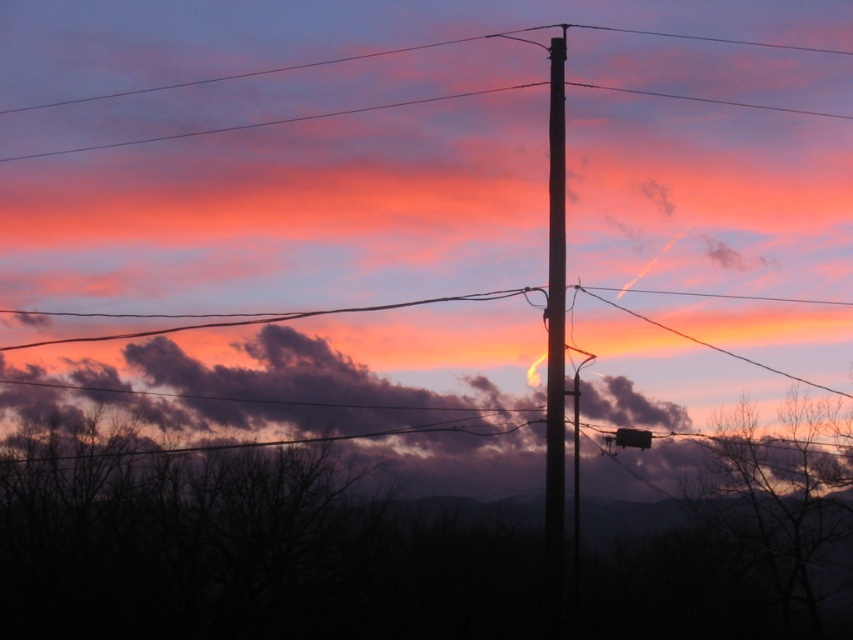
Is purple matte cloud at center to the right of smooth wood telegraph pole at center from the viewer's perspective?

In fact, purple matte cloud at center is to the left of smooth wood telegraph pole at center.

Is purple matte cloud at center to the left of smooth wood telegraph pole at center from the viewer's perspective?

Yes, purple matte cloud at center is to the left of smooth wood telegraph pole at center.

Locate an element on the screen. The image size is (853, 640). purple matte cloud at center is located at coordinates (277, 387).

At what (x,y) coordinates should I click in order to perform the action: click on purple matte cloud at center. Please return your answer as a coordinate pair (x, y). Looking at the image, I should click on click(277, 387).